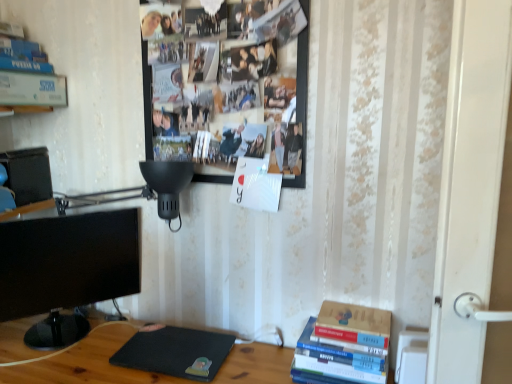
Question: From the image's perspective, is black matte laptop at lower center beneath white matte paperback book at upper left, which ranks as the second paperback book in bottom-to-top order?

Choices:
 (A) no
 (B) yes

Answer: (B)

Question: From a real-world perspective, is black matte laptop at lower center under white matte paperback book at upper left, the 1th paperback book positioned from the left?

Choices:
 (A) no
 (B) yes

Answer: (B)

Question: Is black matte laptop at lower center aimed at white matte paperback book at upper left, the 1th paperback book positioned from the left?

Choices:
 (A) yes
 (B) no

Answer: (B)

Question: Considering the relative sizes of black matte laptop at lower center and white matte paperback book at upper left, which ranks as the second paperback book in bottom-to-top order, in the image provided, is black matte laptop at lower center smaller than white matte paperback book at upper left, which ranks as the second paperback book in bottom-to-top order,?

Choices:
 (A) no
 (B) yes

Answer: (B)

Question: Is black matte laptop at lower center at the right side of white matte paperback book at upper left, the 2th paperback book from the right?

Choices:
 (A) no
 (B) yes

Answer: (B)

Question: Is black matte laptop at lower center thinner than white matte paperback book at upper left, the 1th paperback book positioned from the left?

Choices:
 (A) yes
 (B) no

Answer: (B)

Question: Can you confirm if black matte laptop at lower center is positioned to the left of hardcover books at lower right?

Choices:
 (A) no
 (B) yes

Answer: (B)

Question: Considering the relative sizes of black matte laptop at lower center and hardcover books at lower right in the image provided, is black matte laptop at lower center thinner than hardcover books at lower right?

Choices:
 (A) no
 (B) yes

Answer: (A)

Question: Is black matte laptop at lower center to the right of hardcover books at lower right from the viewer's perspective?

Choices:
 (A) yes
 (B) no

Answer: (B)

Question: From a real-world perspective, is black matte laptop at lower center below hardcover books at lower right?

Choices:
 (A) yes
 (B) no

Answer: (A)

Question: From the image's perspective, is black matte laptop at lower center below hardcover books at lower right?

Choices:
 (A) yes
 (B) no

Answer: (A)

Question: Does black matte laptop at lower center turn towards hardcover books at lower right?

Choices:
 (A) no
 (B) yes

Answer: (A)

Question: Considering the relative sizes of hardcover books at lower right and black glossy monitor at left in the image provided, is hardcover books at lower right bigger than black glossy monitor at left?

Choices:
 (A) yes
 (B) no

Answer: (B)